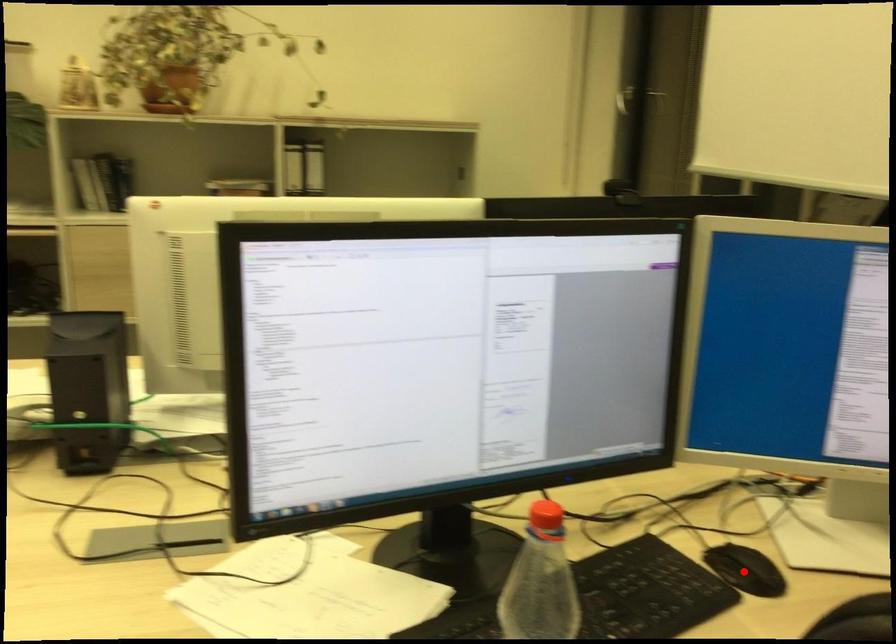
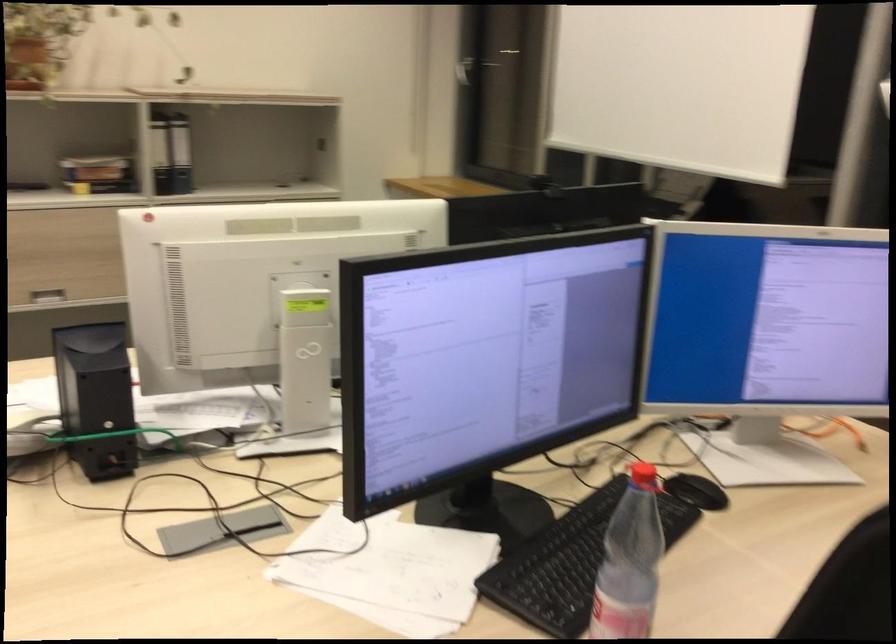
The point at the highlighted location is marked in the first image. Where is the corresponding point in the second image?

(695, 491)